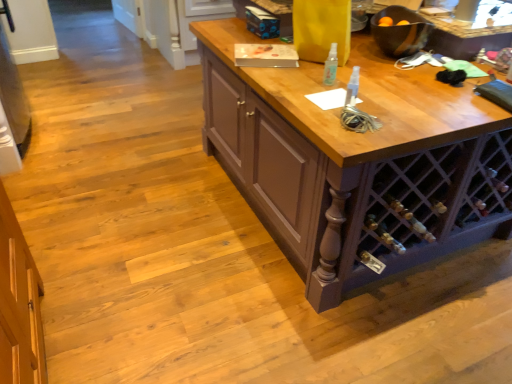
Question: Considering the positions of point coord(324,81) and point coord(394,241), is point coord(324,81) closer or farther from the camera than point coord(394,241)?

Choices:
 (A) farther
 (B) closer

Answer: (B)

Question: From a real-world perspective, is clear plastic spray bottle at center positioned above or below metallic silver wine bottle at lower right?

Choices:
 (A) below
 (B) above

Answer: (B)

Question: Considering the positions of clear plastic spray bottle at center and metallic silver wine bottle at lower right in the image, is clear plastic spray bottle at center wider or thinner than metallic silver wine bottle at lower right?

Choices:
 (A) wide
 (B) thin

Answer: (B)

Question: Based on their sizes in the image, would you say metallic silver wine bottle at lower right is bigger or smaller than clear plastic spray bottle at center?

Choices:
 (A) small
 (B) big

Answer: (B)

Question: Considering the positions of metallic silver wine bottle at lower right and clear plastic spray bottle at center in the image, is metallic silver wine bottle at lower right wider or thinner than clear plastic spray bottle at center?

Choices:
 (A) thin
 (B) wide

Answer: (B)

Question: Would you say metallic silver wine bottle at lower right is inside or outside clear plastic spray bottle at center?

Choices:
 (A) inside
 (B) outside

Answer: (B)

Question: From their relative heights in the image, would you say metallic silver wine bottle at lower right is taller or shorter than clear plastic spray bottle at center?

Choices:
 (A) tall
 (B) short

Answer: (B)